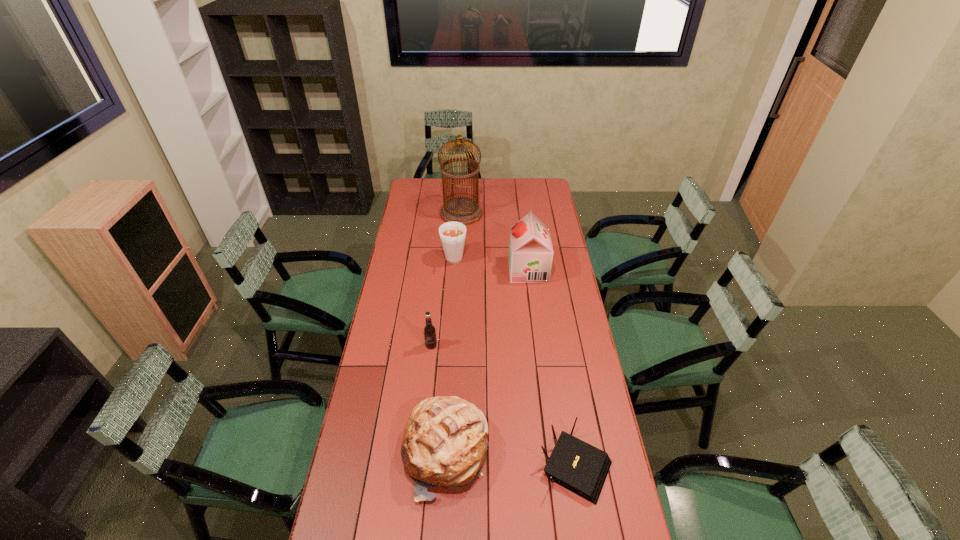
What are the coordinates of `vacant area between the second tallest object and the nearer root beer` in the screenshot? It's located at (480, 308).

I want to click on free space that is in between the farther root beer and the soya milk, so click(492, 266).

Select which object is the second closest to the bread. Please provide its 2D coordinates. Your answer should be formatted as a tuple, i.e. [(x, y)], where the tuple contains the x and y coordinates of a point satisfying the conditions above.

[(429, 330)]

Identify which object is the nearest to the farthest object. Please provide its 2D coordinates. Your answer should be formatted as a tuple, i.e. [(x, y)], where the tuple contains the x and y coordinates of a point satisfying the conditions above.

[(452, 234)]

Where is `blank space that satisfies the following two spatial constraints: 1. with the cap open on the soya milk; 2. on the right side of the shortest object`? blank space that satisfies the following two spatial constraints: 1. with the cap open on the soya milk; 2. on the right side of the shortest object is located at coordinates (552, 465).

This screenshot has height=540, width=960. I want to click on vacant area that satisfies the following two spatial constraints: 1. on the front-facing side of the birdcage; 2. on the label of the shorter root beer, so point(454,346).

What are the coordinates of `free space in the image that satisfies the following two spatial constraints: 1. on the drink side of the bread; 2. on the left side of the taller root beer` in the screenshot? It's located at (441, 453).

Find the location of `free space that satisfies the following two spatial constraints: 1. on the front-facing side of the farthest object; 2. on the drink side of the fourth shortest object`. free space that satisfies the following two spatial constraints: 1. on the front-facing side of the farthest object; 2. on the drink side of the fourth shortest object is located at coordinates [x=459, y=262].

At what (x,y) coordinates should I click in order to perform the action: click on vacant space that satisfies the following two spatial constraints: 1. on the label of the shorter root beer; 2. on the left side of the shortest object. Please return your answer as a coordinate pair (x, y). Looking at the image, I should click on (419, 465).

Image resolution: width=960 pixels, height=540 pixels. In order to click on vacant space that satisfies the following two spatial constraints: 1. with the cap open on the second tallest object; 2. on the label of the nearer root beer in this screenshot , I will do `click(538, 346)`.